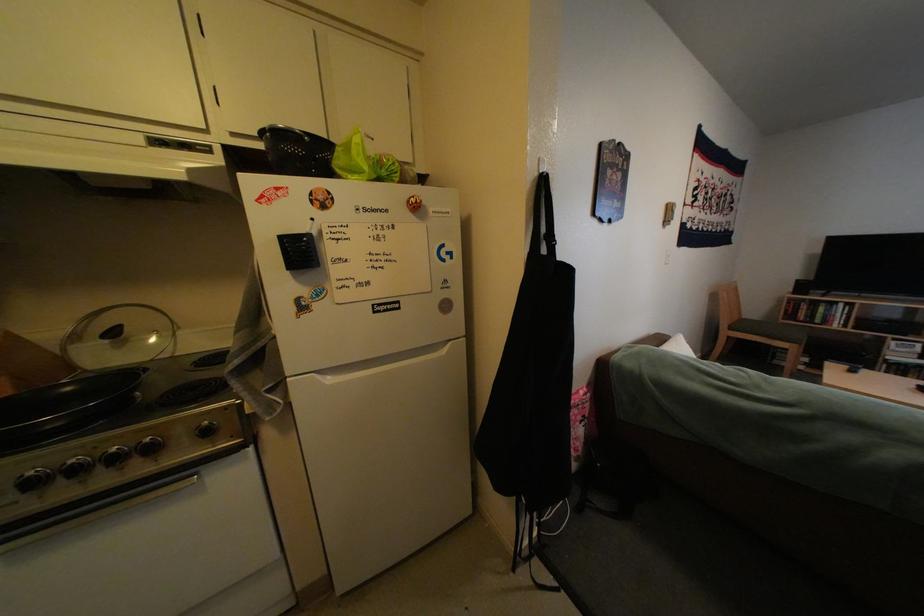
I want to click on white wall hook, so click(x=667, y=214).